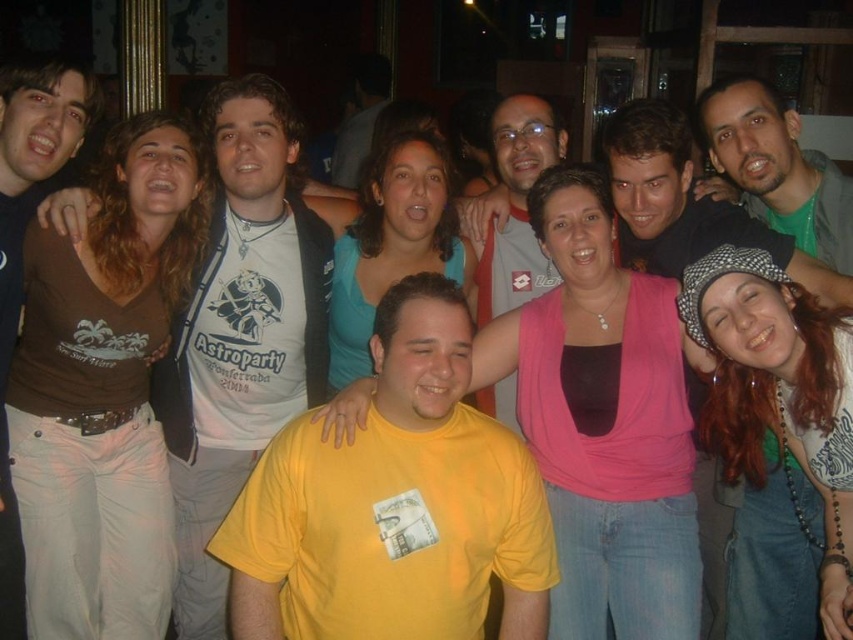
You are taking a photo of the group and want to focus on both the point at (x=448, y=339) and the point at (x=282, y=288). Since the camera can only focus on one depth at a time, which point should you prioritize to ensure the closer one is sharp?

You should prioritize focusing on point (x=282, y=288) because it is farther from the camera compared to point (x=448, y=339), which is closer. Wait, no, the description says the first point is closer. Hmm, maybe I need to recheck the rules.